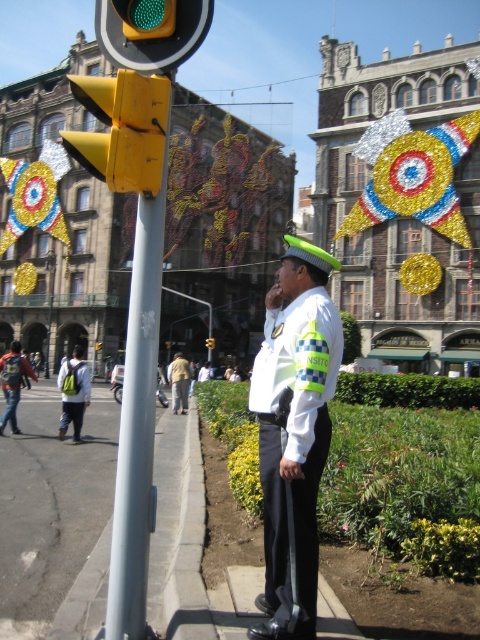
Question: Is the position of yellow matte pole at left more distant than that of green glass traffic light at upper center?

Choices:
 (A) yes
 (B) no

Answer: (A)

Question: Which of these objects is positioned closest to the denim jacket at left?

Choices:
 (A) light brown fabric jacket at center
 (B) yellow matte pole at left
 (C) yellow matte traffic light at left
 (D) light gray backpack at left

Answer: (D)

Question: Observing the image, what is the correct spatial positioning of green glass traffic light at upper center in reference to yellow plastic traffic light at upper left?

Choices:
 (A) below
 (B) above

Answer: (B)

Question: Which of the following is the farthest from the observer?

Choices:
 (A) (76, 428)
 (B) (24, 378)
 (C) (208, 339)
 (D) (206, 20)

Answer: (C)

Question: Which is nearer to the gray concrete sidewalk at lower left?

Choices:
 (A) green glass traffic light at upper center
 (B) light brown fabric jacket at center
 (C) yellow plastic traffic light at upper left

Answer: (B)

Question: Can you confirm if yellow matte pole at left is positioned to the right of green glass traffic light at upper center?

Choices:
 (A) yes
 (B) no

Answer: (B)